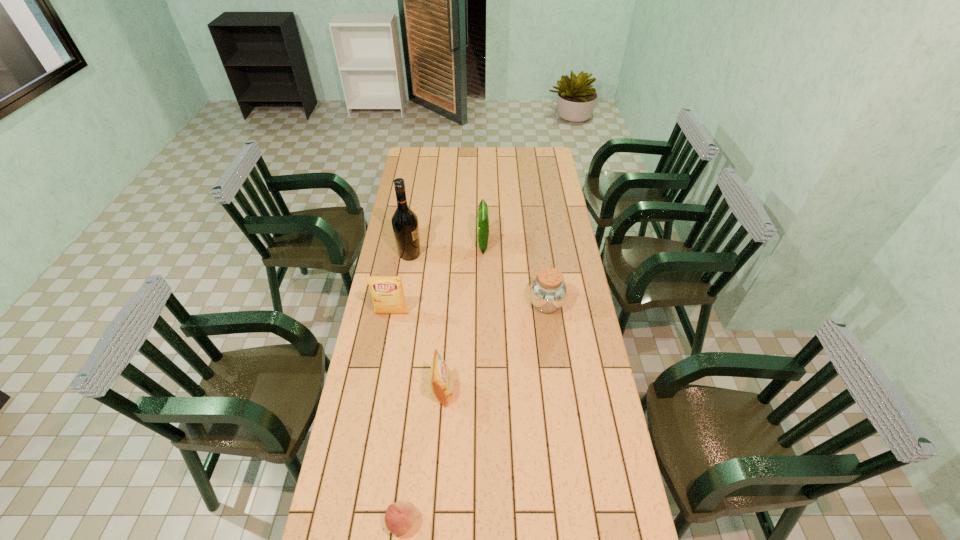
Where is `vacant space that's between the shortest object and the rightmost object`? Image resolution: width=960 pixels, height=540 pixels. vacant space that's between the shortest object and the rightmost object is located at coordinates (474, 413).

Locate an element on the screen. This screenshot has height=540, width=960. vacant area between the jar and the leftmost crisp (potato chip) is located at coordinates (468, 309).

Where is `free point between the leftmost crisp (potato chip) and the farthest crisp (potato chip)`? This screenshot has width=960, height=540. free point between the leftmost crisp (potato chip) and the farthest crisp (potato chip) is located at coordinates (438, 279).

Where is `vacant point located between the nearest crisp (potato chip) and the second farthest crisp (potato chip)`? Image resolution: width=960 pixels, height=540 pixels. vacant point located between the nearest crisp (potato chip) and the second farthest crisp (potato chip) is located at coordinates (418, 353).

Locate which object is the fourth closest to the second nearest object. Please provide its 2D coordinates. Your answer should be formatted as a tuple, i.e. [(x, y)], where the tuple contains the x and y coordinates of a point satisfying the conditions above.

[(405, 225)]

This screenshot has width=960, height=540. In order to click on object that can be found as the fifth closest to the nearest crisp (potato chip) in this screenshot , I will do `click(483, 224)`.

The width and height of the screenshot is (960, 540). I want to click on crisp (potato chip) that is the second closest to the second nearest crisp (potato chip), so click(x=483, y=224).

Locate which crisp (potato chip) ranks in proximity to the farthest crisp (potato chip). Please provide its 2D coordinates. Your answer should be formatted as a tuple, i.e. [(x, y)], where the tuple contains the x and y coordinates of a point satisfying the conditions above.

[(387, 292)]

Locate an element on the screen. The height and width of the screenshot is (540, 960). free point that satisfies the following two spatial constraints: 1. on the front-facing side of the second object from right to left; 2. on the left side of the jar is located at coordinates (484, 304).

This screenshot has height=540, width=960. I want to click on vacant region that satisfies the following two spatial constraints: 1. on the front of the peach with the logo; 2. on the right side of the leftmost crisp (potato chip), so click(x=354, y=522).